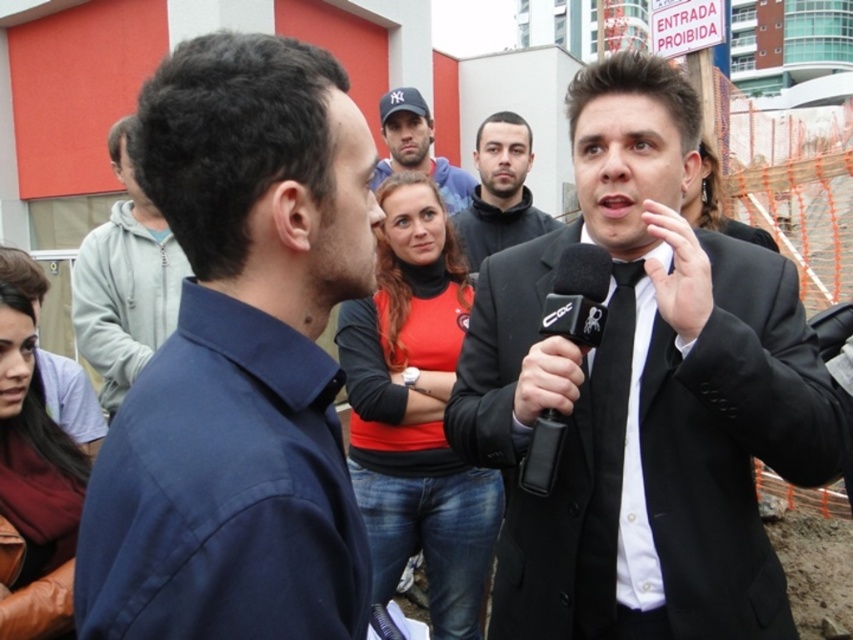
Question: Among these objects, which one is farthest from the camera?

Choices:
 (A) matte black suit at center
 (B) light gray hoodie at upper left

Answer: (A)

Question: Which point is closer to the camera?

Choices:
 (A) (115, 282)
 (B) (299, 84)

Answer: (B)

Question: Is black matte suit at center wider than matte black suit at center?

Choices:
 (A) yes
 (B) no

Answer: (A)

Question: Is black plastic microphone at center to the right of matte black cap at upper center from the viewer's perspective?

Choices:
 (A) no
 (B) yes

Answer: (B)

Question: Can you confirm if leather jacket at lower left is positioned above black plastic microphone at center?

Choices:
 (A) yes
 (B) no

Answer: (B)

Question: Which is farther from the matte black suit at center?

Choices:
 (A) light gray hoodie at upper left
 (B) black matte suit at center

Answer: (B)